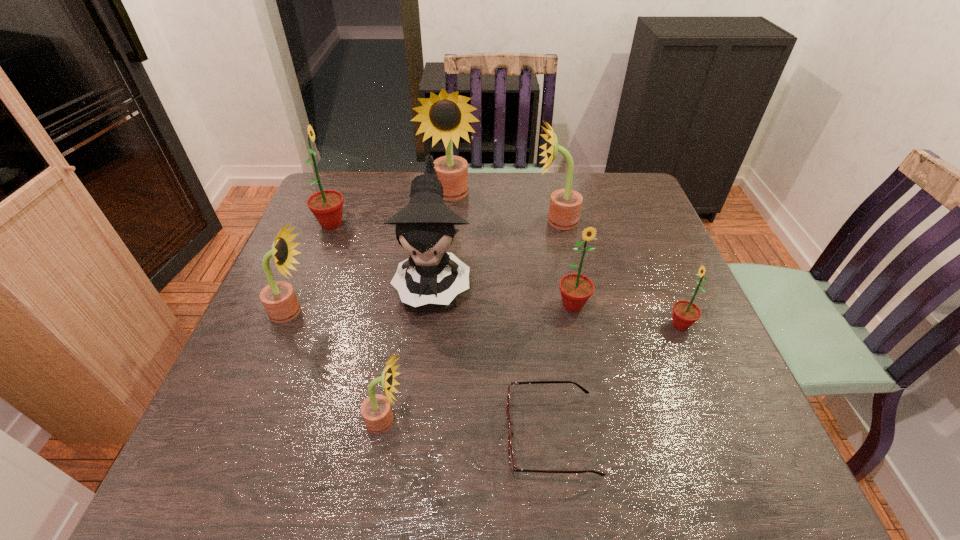
Where is `the nearest yellow sunflower`? the nearest yellow sunflower is located at coordinates (376, 411).

Locate an element on the screen. This screenshot has height=540, width=960. the rightmost object is located at coordinates (685, 313).

Locate an element on the screen. the smallest green sunflower is located at coordinates (685, 313).

Locate an element on the screen. This screenshot has width=960, height=540. red spectacles is located at coordinates (513, 468).

You are a GUI agent. You are given a task and a screenshot of the screen. Output one action in this format:
    pyautogui.click(x=<x>, y=<y>)
    Task: Click on the spectacles
    
    Given the screenshot: What is the action you would take?
    click(x=513, y=468)

Identify the location of vacant area situated on the face of the tallest sunflower. The image size is (960, 540). (446, 249).

You are a GUI agent. You are given a task and a screenshot of the screen. Output one action in this format:
    pyautogui.click(x=<x>, y=<y>)
    Task: Click on the free space located 0.160m on the face of the second biggest yellow sunflower
    
    Given the screenshot: What is the action you would take?
    coord(479,221)

The image size is (960, 540). I want to click on free space located 0.400m on the face of the second biggest yellow sunflower, so click(x=396, y=221).

Locate an element on the screen. free space located 0.070m on the face of the second biggest yellow sunflower is located at coordinates (510, 221).

Where is `vacant space situated on the face of the farthest green sunflower`? Image resolution: width=960 pixels, height=540 pixels. vacant space situated on the face of the farthest green sunflower is located at coordinates (440, 224).